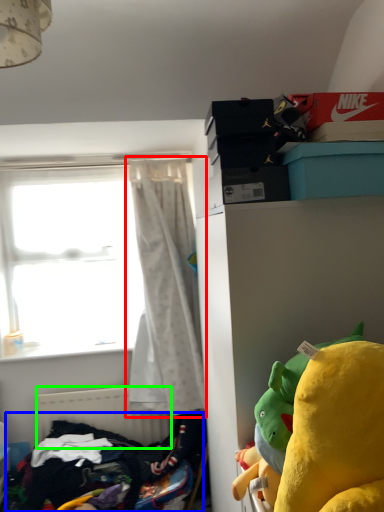
Question: Which object is the farthest from curtain (highlighted by a red box)? Choose among these: clothing (highlighted by a blue box) or radiator (highlighted by a green box).

Choices:
 (A) clothing
 (B) radiator

Answer: (A)